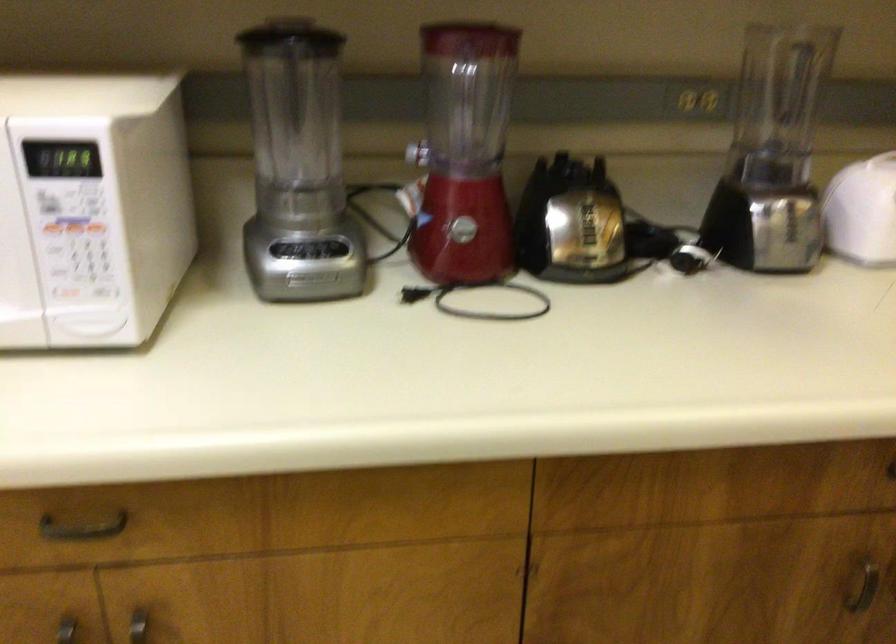
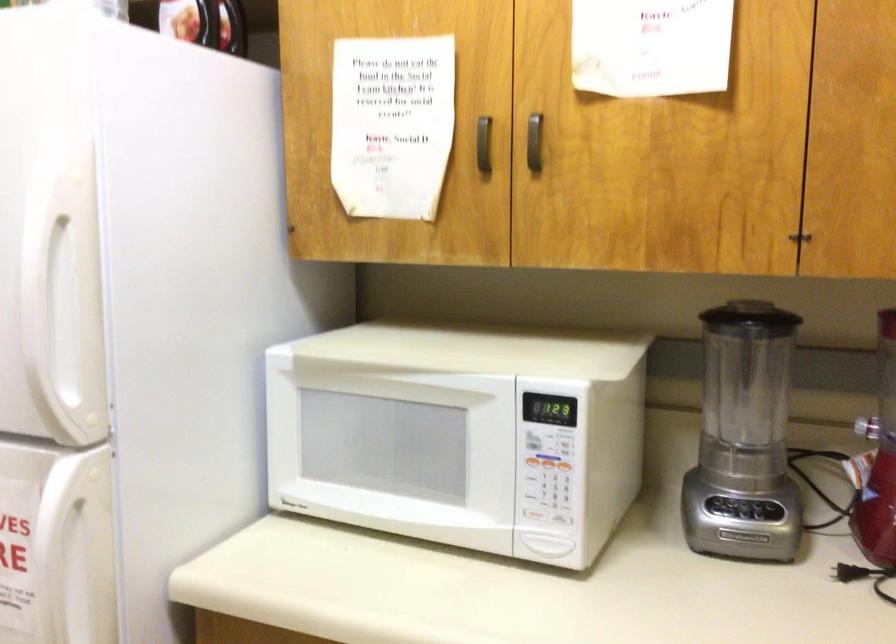
Where in the second image is the point corresponding to point 295,102 from the first image?

(746, 371)